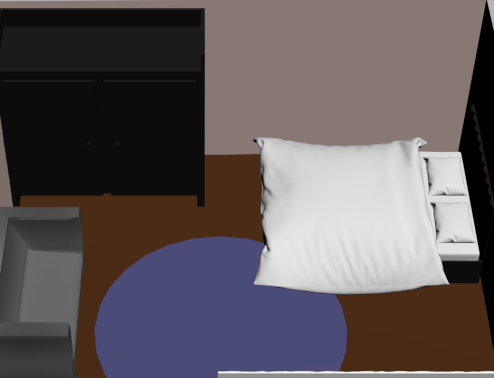
This screenshot has height=378, width=494. Identify the location of armoire legs. (202, 205), (15, 201).